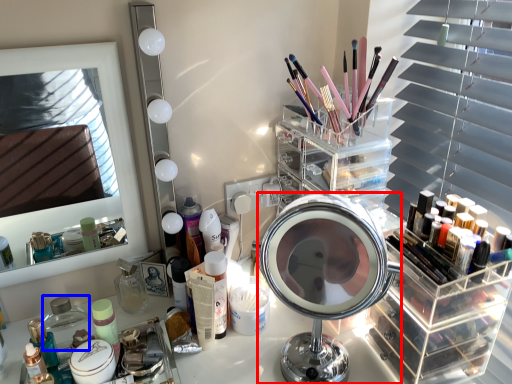
Question: Which point is closer to the camera, mirror (highlighted by a red box) or toiletry (highlighted by a blue box)?

Choices:
 (A) mirror
 (B) toiletry

Answer: (A)